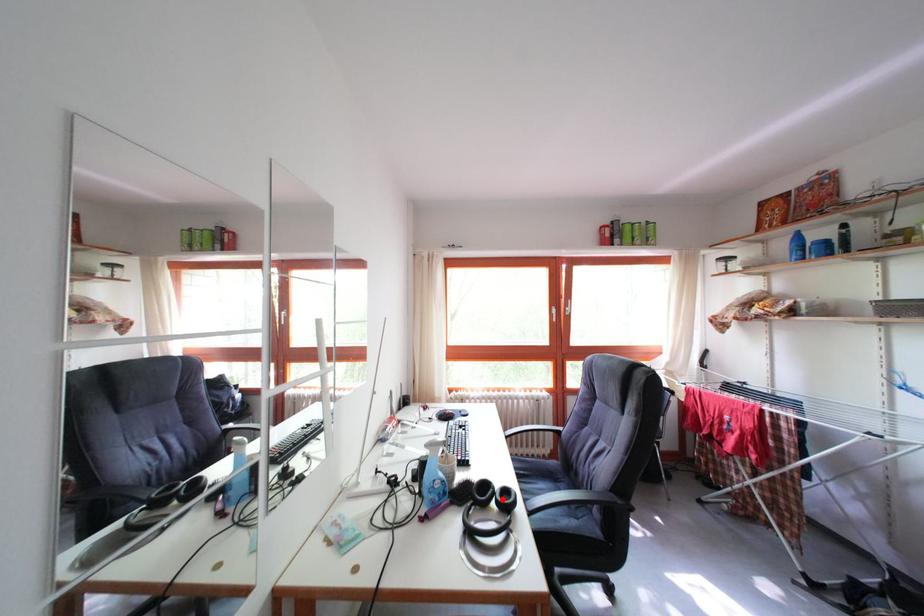
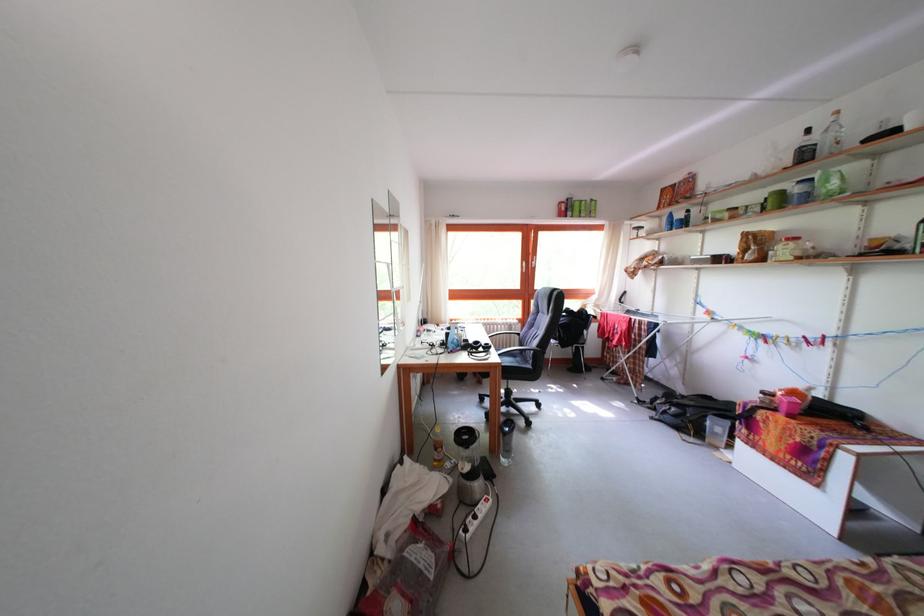
Locate, in the second image, the point that corresponds to the highlighted location in the first image.

(489, 352)